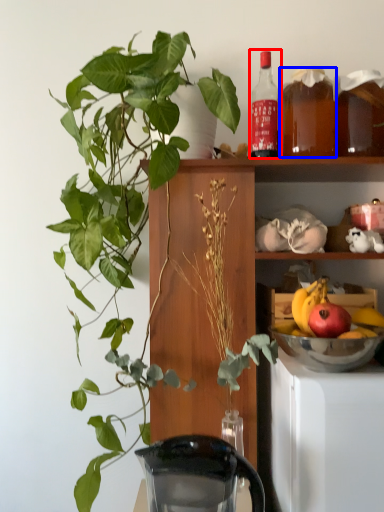
Question: Which object appears closest to the camera in this image, bottle (highlighted by a red box) or beverage (highlighted by a blue box)?

Choices:
 (A) bottle
 (B) beverage

Answer: (B)